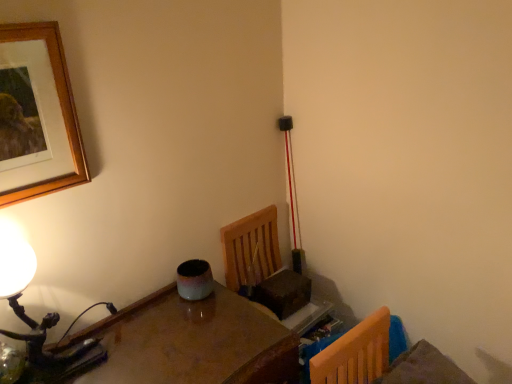
Question: From a real-world perspective, is matte black table lamp at left physically located above or below glossy wooden table at lower left?

Choices:
 (A) above
 (B) below

Answer: (A)

Question: Considering the positions of matte black table lamp at left and glossy wooden table at lower left in the image, is matte black table lamp at left taller or shorter than glossy wooden table at lower left?

Choices:
 (A) tall
 (B) short

Answer: (B)

Question: Estimate the real-world distances between objects in this image. Which object is closer to the matte black table lamp at left?

Choices:
 (A) glossy wooden table at lower left
 (B) wooden picture frame at upper left

Answer: (A)

Question: Which is nearer to the matte black table lamp at left?

Choices:
 (A) glossy wooden table at lower left
 (B) wooden picture frame at upper left

Answer: (A)